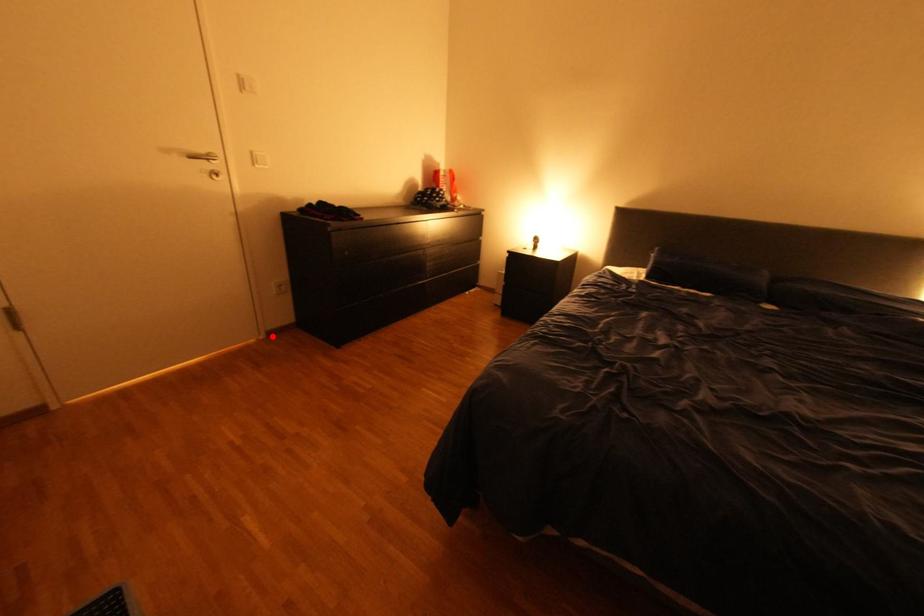
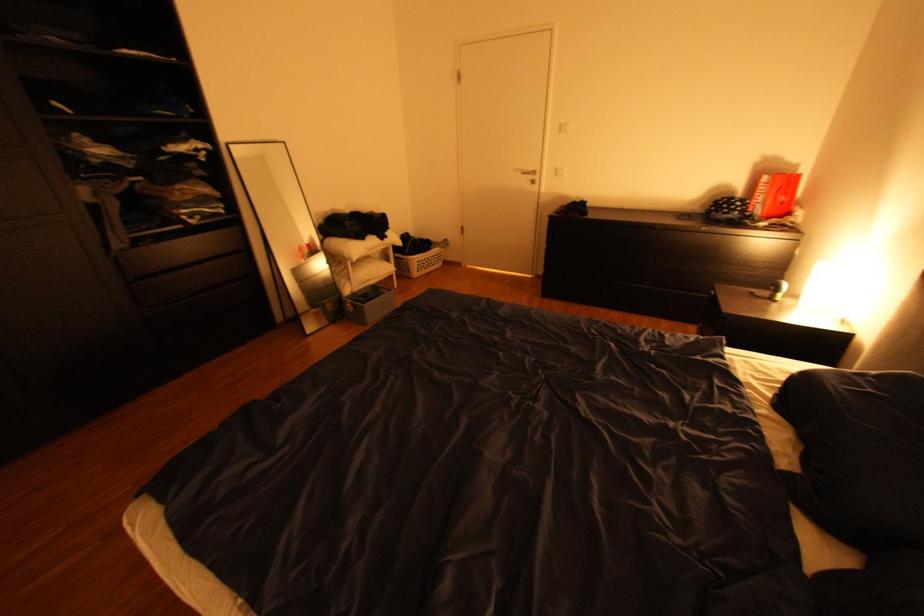
Question: I am providing you with two images of the same scene from different viewpoints. A red point is marked on the first image. Is the red point's position out of view in image 2?

Choices:
 (A) Yes
 (B) No

Answer: (B)